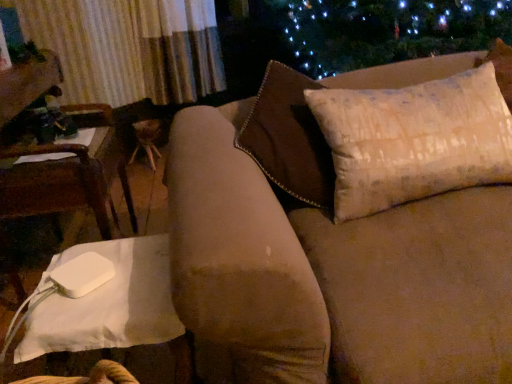
Question: Considering the positions of white fabric chair at left and suede-like brown couch at upper right in the image, is white fabric chair at left bigger or smaller than suede-like brown couch at upper right?

Choices:
 (A) small
 (B) big

Answer: (A)

Question: Is white fabric chair at left spatially inside suede-like brown couch at upper right, or outside of it?

Choices:
 (A) outside
 (B) inside

Answer: (A)

Question: Estimate the real-world distances between objects in this image. Which object is farther from the white fabric chair at left?

Choices:
 (A) suede-like brown couch at upper right
 (B) white fabric table at lower left
 (C) beige textured pillow at upper right

Answer: (C)

Question: Based on their relative distances, which object is farther from the beige textured pillow at upper right?

Choices:
 (A) suede-like brown couch at upper right
 (B) white fabric table at lower left
 (C) white fabric chair at left

Answer: (C)